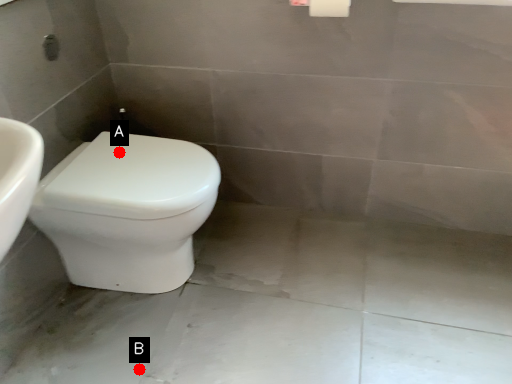
Question: Two points are circled on the image, labeled by A and B beside each circle. Among these points, which one is farthest from the camera?

Choices:
 (A) A is further
 (B) B is further

Answer: (A)